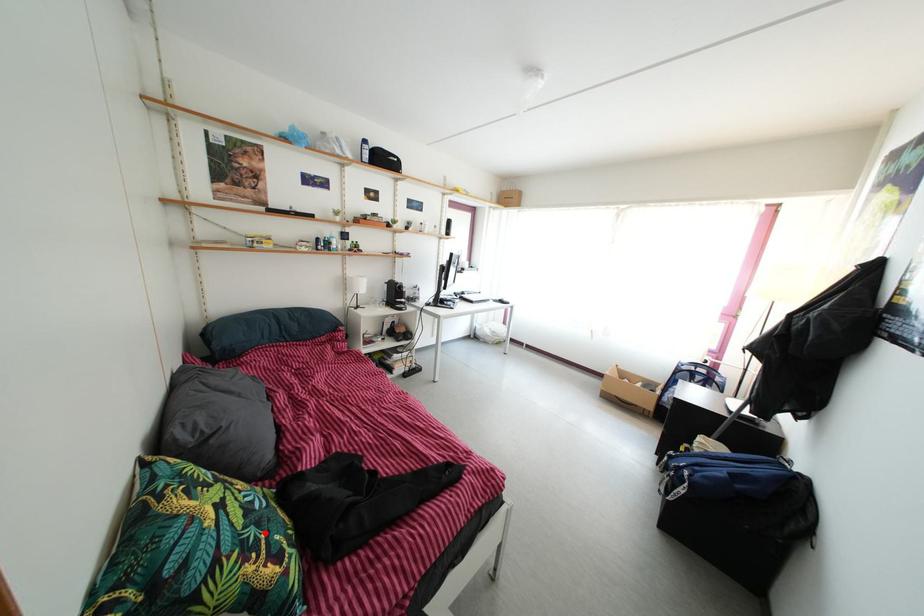
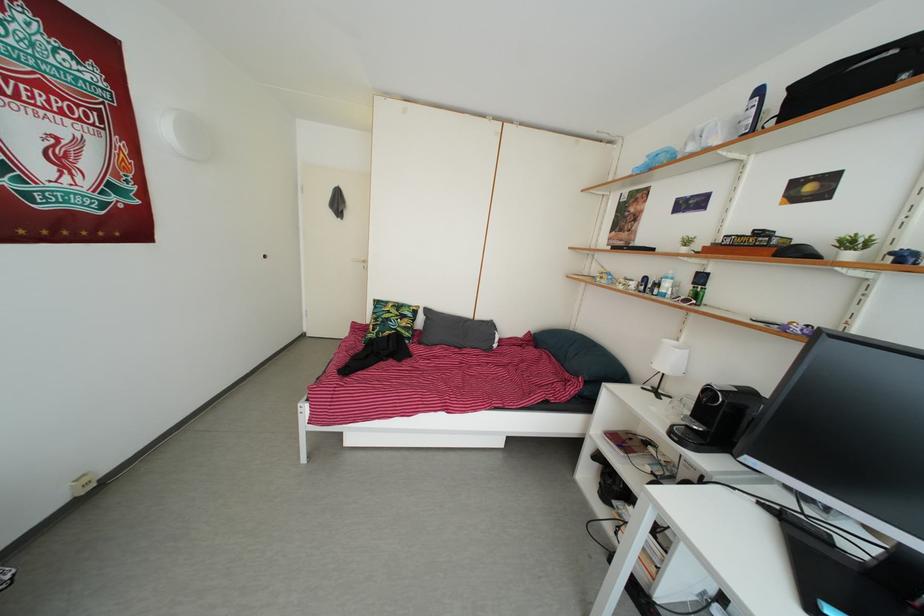
Find the pixel in the second image that matches the highlighted location in the first image.

(388, 330)